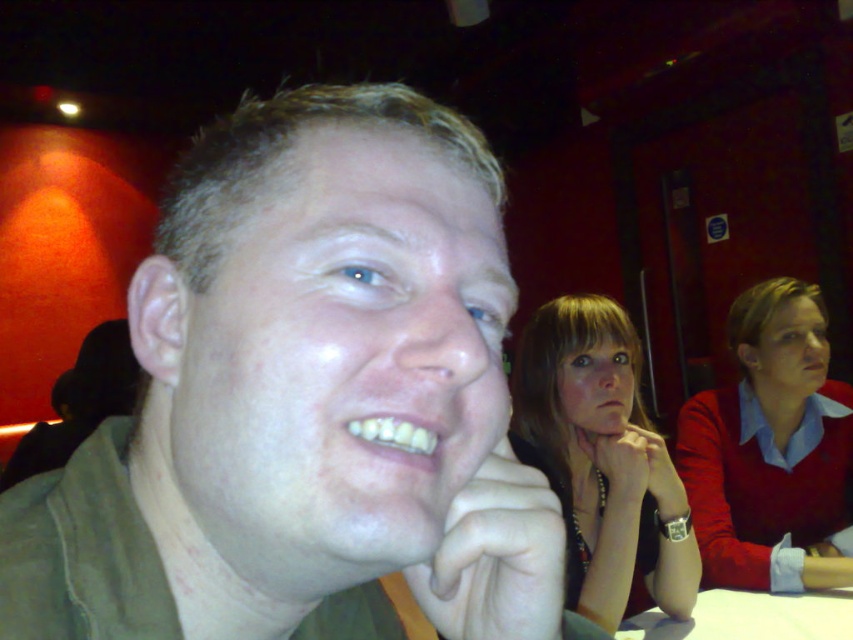
In the scene shown: Does yellowish matte teeth at lower center have a greater width compared to white matte mouth at center?

Incorrect, yellowish matte teeth at lower center's width does not surpass white matte mouth at center's.

Does yellowish matte teeth at lower center appear on the right side of white matte mouth at center?

In fact, yellowish matte teeth at lower center is to the left of white matte mouth at center.

Does point (379, 435) lie in front of point (611, 412)?

Yes, point (379, 435) is in front of point (611, 412).

This screenshot has height=640, width=853. Identify the location of yellowish matte teeth at lower center. (393, 435).

Can you confirm if white matte hand at lower center is positioned above yellowish matte teeth at lower center?

Incorrect, white matte hand at lower center is not positioned above yellowish matte teeth at lower center.

Is white matte hand at lower center below yellowish matte teeth at lower center?

Yes, white matte hand at lower center is below yellowish matte teeth at lower center.

The width and height of the screenshot is (853, 640). What are the coordinates of `white matte hand at lower center` in the screenshot? It's located at (496, 557).

The width and height of the screenshot is (853, 640). What do you see at coordinates (305, 401) in the screenshot?
I see `matte green shirt at center` at bounding box center [305, 401].

Does matte green shirt at center have a lesser width compared to matte skin at mouth center?

Incorrect, matte green shirt at center's width is not less than matte skin at mouth center's.

Locate an element on the screen. matte green shirt at center is located at coordinates (305, 401).

Where is `matte green shirt at center`? This screenshot has height=640, width=853. matte green shirt at center is located at coordinates coord(305,401).